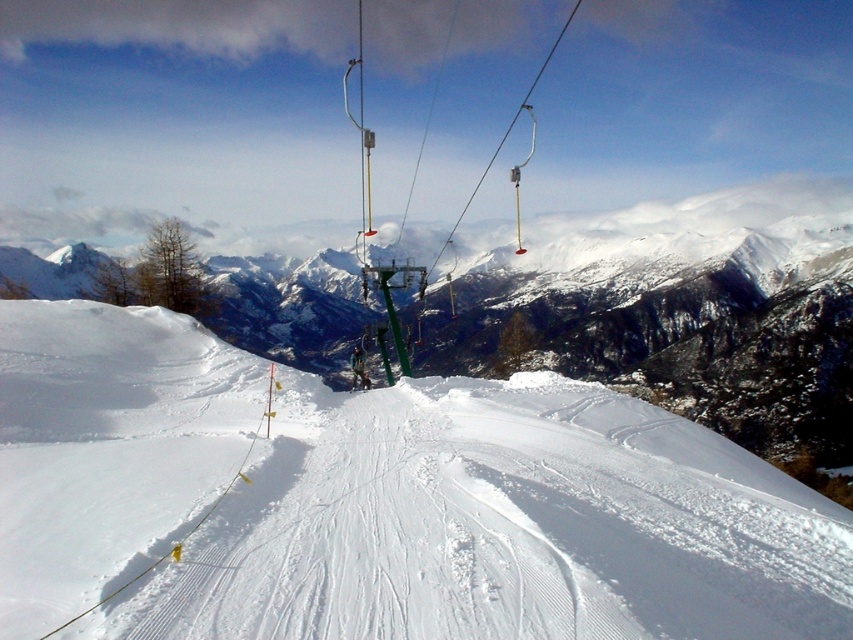
Who is higher up, white snow at center or green metallic ski lift at center?

green metallic ski lift at center is above.

Where is `white snow at center`? white snow at center is located at coordinates (378, 500).

Image resolution: width=853 pixels, height=640 pixels. Find the location of `white snow at center`. white snow at center is located at coordinates (378, 500).

Consider the image. Who is lower down, white snow at center or matte black ski at center?

matte black ski at center

Locate an element on the screen. This screenshot has width=853, height=640. white snow at center is located at coordinates (378, 500).

Is green metallic ski lift at center wider than matte black ski at center?

Correct, the width of green metallic ski lift at center exceeds that of matte black ski at center.

Does green metallic ski lift at center appear under matte black ski at center?

Actually, green metallic ski lift at center is above matte black ski at center.

Who is more forward, (364, 296) or (357, 388)?

Positioned in front is point (357, 388).

Identify the location of green metallic ski lift at center. (506, 131).